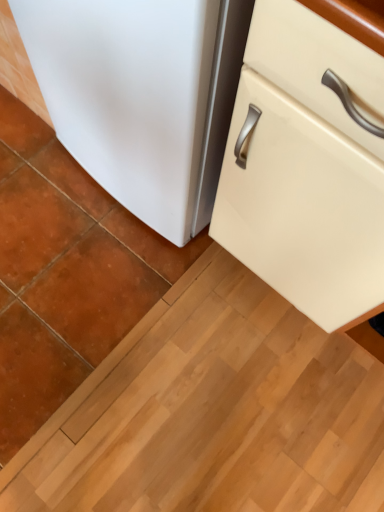
Where is `vacant space in front of white matte refrigerator at lower left`? vacant space in front of white matte refrigerator at lower left is located at coordinates (127, 289).